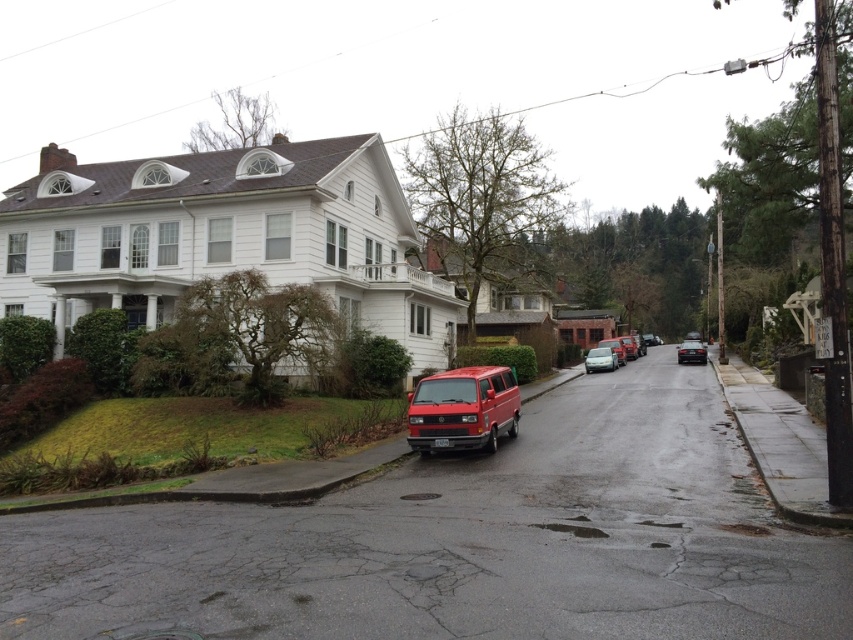
Question: Which point appears farthest from the camera in this image?

Choices:
 (A) (688, 346)
 (B) (610, 365)

Answer: (A)

Question: Can you confirm if metallic silver sedan at center is positioned to the left of shiny black sedan at center?

Choices:
 (A) yes
 (B) no

Answer: (A)

Question: Is matte red van at center above shiny black sedan at center?

Choices:
 (A) yes
 (B) no

Answer: (B)

Question: Which is farther from the metallic silver sedan at center?

Choices:
 (A) matte red van at center
 (B) shiny black sedan at center

Answer: (A)

Question: Estimate the real-world distances between objects in this image. Which object is farther from the metallic silver sedan at center?

Choices:
 (A) shiny black sedan at center
 (B) matte red van at center

Answer: (B)

Question: Does matte red van at center come in front of shiny black sedan at center?

Choices:
 (A) no
 (B) yes

Answer: (B)